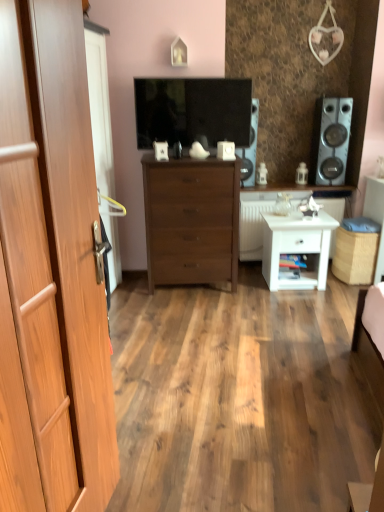
Question: From their relative heights in the image, would you say white matte nightstand at lower right is taller or shorter than light brown wood door at left?

Choices:
 (A) short
 (B) tall

Answer: (A)

Question: Considering the positions of white matte nightstand at lower right and light brown wood door at left in the image, is white matte nightstand at lower right bigger or smaller than light brown wood door at left?

Choices:
 (A) big
 (B) small

Answer: (B)

Question: Estimate the real-world distances between objects in this image. Which object is farther from the satin silver speaker at right, placed as the first speaker when sorted from right to left?

Choices:
 (A) matte black tv at center
 (B) light brown wood door at left
 (C) matte black speaker at center, which ranks as the second speaker in right-to-left order
 (D) brown wooden chest of drawers at center
 (E) white matte nightstand at lower right

Answer: (B)

Question: Which object is the farthest from the light brown wood door at left?

Choices:
 (A) brown wooden chest of drawers at center
 (B) white glossy side table at center right, placed as the 2th counter top when sorted from top to bottom
 (C) matte black speaker at center, placed as the 1th speaker when sorted from left to right
 (D) white matte nightstand at lower right
 (E) wooden cabinet at center, the 1th counter top when ordered from top to bottom

Answer: (E)